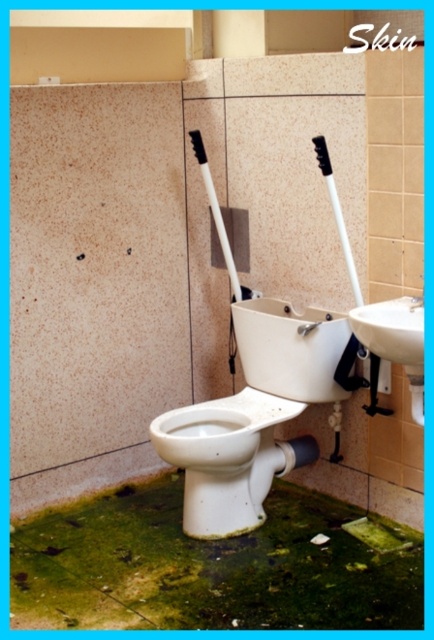
You are standing in a bathroom and want to take a clear photo of the white glossy toilet at center. If your camera requires you to be at least 8 feet away to avoid distortion, can you take the photo without moving closer?

The white glossy toilet at center and camera are 8.25 feet apart from each other, which is more than the required 8 feet distance. Therefore, you can take the photo without moving closer.

Consider the image. You are a plumber inspecting the bathroom. You see the white glossy toilet at center and the white glossy toilet bowl at center. Which one is positioned higher from the floor?

The white glossy toilet at center is positioned higher from the floor than the white glossy toilet bowl at center because it is located above it.